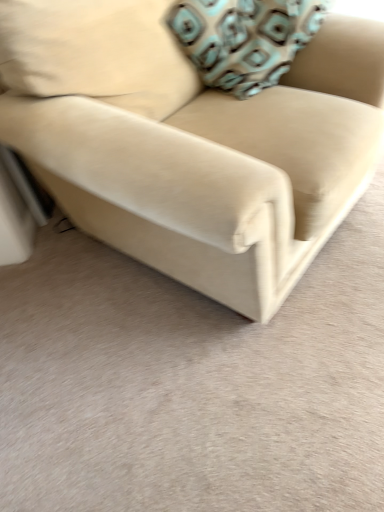
The width and height of the screenshot is (384, 512). Describe the element at coordinates (244, 39) in the screenshot. I see `teal-patterned fabric pillow at upper right` at that location.

Image resolution: width=384 pixels, height=512 pixels. I want to click on teal-patterned fabric pillow at upper right, so click(244, 39).

What do you see at coordinates (191, 142) in the screenshot? This screenshot has height=512, width=384. I see `beige fabric couch at center` at bounding box center [191, 142].

Find the location of a particular element. Image resolution: width=384 pixels, height=512 pixels. beige fabric couch at center is located at coordinates pyautogui.click(x=191, y=142).

Where is `teal-patterned fabric pillow at upper right`? The width and height of the screenshot is (384, 512). teal-patterned fabric pillow at upper right is located at coordinates (244, 39).

Which is more to the right, beige fabric couch at center or teal-patterned fabric pillow at upper right?

Positioned to the right is teal-patterned fabric pillow at upper right.

Relative to teal-patterned fabric pillow at upper right, is beige fabric couch at center in front or behind?

Visually, beige fabric couch at center is located in front of teal-patterned fabric pillow at upper right.

Between point (119, 234) and point (238, 83), which one is positioned in front?

The point (238, 83) is more forward.

From the image's perspective, is beige fabric couch at center located beneath teal-patterned fabric pillow at upper right?

Correct, beige fabric couch at center appears lower than teal-patterned fabric pillow at upper right in the image.

From a real-world perspective, is beige fabric couch at center physically located above or below teal-patterned fabric pillow at upper right?

Clearly, from a real-world perspective, beige fabric couch at center is below teal-patterned fabric pillow at upper right.

Can you confirm if beige fabric couch at center is thinner than teal-patterned fabric pillow at upper right?

No.

Is beige fabric couch at center taller or shorter than teal-patterned fabric pillow at upper right?

Clearly, beige fabric couch at center is taller compared to teal-patterned fabric pillow at upper right.

Is beige fabric couch at center smaller than teal-patterned fabric pillow at upper right?

No.

Is beige fabric couch at center situated inside teal-patterned fabric pillow at upper right or outside?

beige fabric couch at center cannot be found inside teal-patterned fabric pillow at upper right.

Is beige fabric couch at center not near teal-patterned fabric pillow at upper right?

No, beige fabric couch at center is not far from teal-patterned fabric pillow at upper right.

Is teal-patterned fabric pillow at upper right at the back of beige fabric couch at center?

Correct, beige fabric couch at center is looking away from teal-patterned fabric pillow at upper right.

I want to click on studio couch that is under the teal-patterned fabric pillow at upper right (from a real-world perspective), so click(191, 142).

Is teal-patterned fabric pillow at upper right to the left of beige fabric couch at center from the viewer's perspective?

In fact, teal-patterned fabric pillow at upper right is to the right of beige fabric couch at center.

Is the position of teal-patterned fabric pillow at upper right more distant than that of beige fabric couch at center?

Yes, teal-patterned fabric pillow at upper right is further from the viewer.

Is point (211, 53) farther from camera compared to point (127, 239)?

Yes, it is behind point (127, 239).

From the image's perspective, relative to beige fabric couch at center, is teal-patterned fabric pillow at upper right above or below?

teal-patterned fabric pillow at upper right is situated higher than beige fabric couch at center in the image.

From a real-world perspective, is teal-patterned fabric pillow at upper right positioned over beige fabric couch at center based on gravity?

Yes, from a real-world perspective, teal-patterned fabric pillow at upper right is above beige fabric couch at center.

Which of these two, teal-patterned fabric pillow at upper right or beige fabric couch at center, is wider?

Wider between the two is beige fabric couch at center.

Who is taller, teal-patterned fabric pillow at upper right or beige fabric couch at center?

With more height is beige fabric couch at center.

Considering the relative sizes of teal-patterned fabric pillow at upper right and beige fabric couch at center in the image provided, is teal-patterned fabric pillow at upper right smaller than beige fabric couch at center?

Yes.

Is teal-patterned fabric pillow at upper right inside the boundaries of beige fabric couch at center, or outside?

teal-patterned fabric pillow at upper right lies within the bounds of beige fabric couch at center.

Can you see teal-patterned fabric pillow at upper right touching beige fabric couch at center?

No, teal-patterned fabric pillow at upper right is not in contact with beige fabric couch at center.

Does teal-patterned fabric pillow at upper right turn towards beige fabric couch at center?

Yes, teal-patterned fabric pillow at upper right faces towards beige fabric couch at center.

This screenshot has height=512, width=384. There is a beige fabric couch at center. What are the coordinates of `throw pillow above it (from a real-world perspective)` in the screenshot? It's located at (244, 39).

Identify the location of studio couch in front of the teal-patterned fabric pillow at upper right. The image size is (384, 512). (191, 142).

Locate an element on the screen. Image resolution: width=384 pixels, height=512 pixels. throw pillow that is above the beige fabric couch at center (from a real-world perspective) is located at coordinates (244, 39).